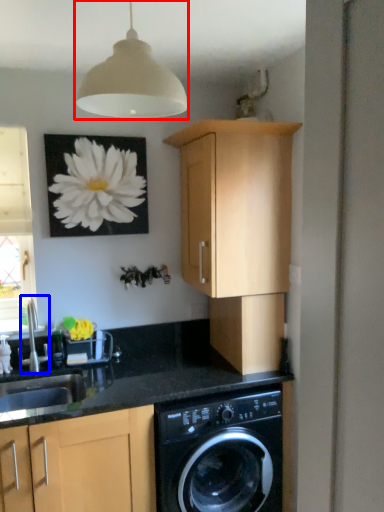
Question: Which object is further to the camera taking this photo, lamp (highlighted by a red box) or faucet (highlighted by a blue box)?

Choices:
 (A) lamp
 (B) faucet

Answer: (B)